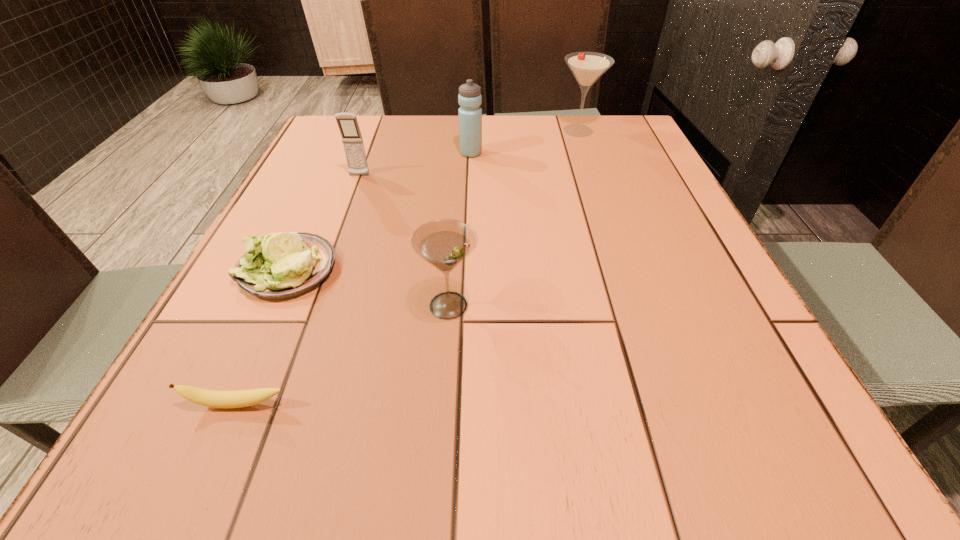
I want to click on the farthest object, so click(x=587, y=67).

Where is `the right martini`? The height and width of the screenshot is (540, 960). the right martini is located at coordinates (587, 67).

The width and height of the screenshot is (960, 540). I want to click on water bottle, so click(x=469, y=98).

Identify the location of the shorter martini. This screenshot has width=960, height=540. (444, 243).

You are a GUI agent. You are given a task and a screenshot of the screen. Output one action in this format:
    pyautogui.click(x=<x>, y=<y>)
    Task: Click on the nearer martini
    The width and height of the screenshot is (960, 540).
    Given the screenshot: What is the action you would take?
    tap(444, 243)

You are a GUI agent. You are given a task and a screenshot of the screen. Output one action in this format:
    pyautogui.click(x=<x>, y=<y>)
    Task: Click on the third farthest object
    The image size is (960, 540).
    Given the screenshot: What is the action you would take?
    pyautogui.click(x=348, y=125)

At what (x,y) coordinates should I click in order to perform the action: click on lettuce. Please return your answer as a coordinate pair (x, y). Looking at the image, I should click on (283, 265).

Image resolution: width=960 pixels, height=540 pixels. Identify the location of banana. (211, 398).

The image size is (960, 540). What are the coordinates of `the nearest object` in the screenshot? It's located at (211, 398).

Where is `vacant space located 0.240m on the front of the rightmost object`? The height and width of the screenshot is (540, 960). vacant space located 0.240m on the front of the rightmost object is located at coordinates (598, 188).